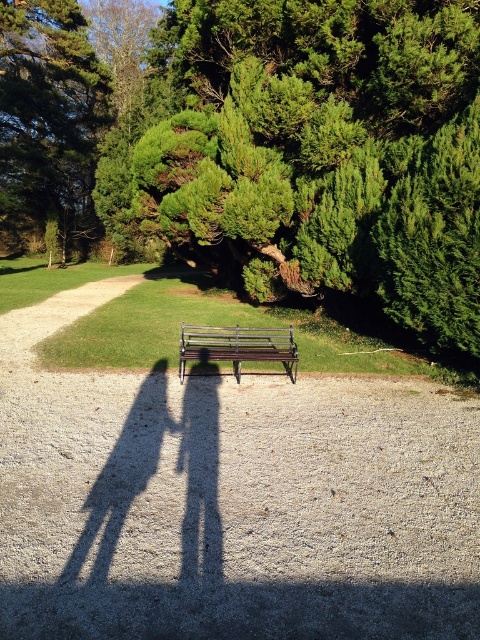
This screenshot has height=640, width=480. Describe the element at coordinates (48, 116) in the screenshot. I see `green leafy tree at upper left` at that location.

Where is `green leafy tree at upper left`? This screenshot has height=640, width=480. green leafy tree at upper left is located at coordinates (48, 116).

Locate an element on the screen. This screenshot has width=480, height=640. green leafy tree at upper left is located at coordinates (48, 116).